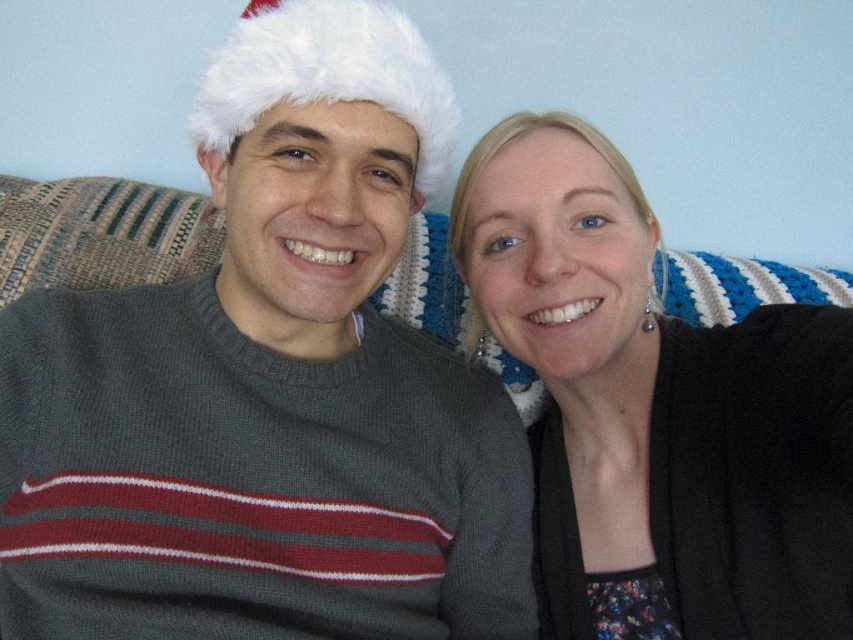
Can you confirm if black matte sweater at right is positioned to the right of white fluffy hat at upper center?

Indeed, black matte sweater at right is positioned on the right side of white fluffy hat at upper center.

Can you confirm if black matte sweater at right is thinner than white fluffy hat at upper center?

In fact, black matte sweater at right might be wider than white fluffy hat at upper center.

Is point (648, 525) positioned behind point (207, 65)?

Yes, point (648, 525) is behind point (207, 65).

This screenshot has height=640, width=853. Find the location of `black matte sweater at right`. black matte sweater at right is located at coordinates (656, 410).

Who is higher up, knit gray sweater at center or white fluffy hat at upper center?

Positioned higher is white fluffy hat at upper center.

From the picture: Is knit gray sweater at center above white fluffy hat at upper center?

No, knit gray sweater at center is not above white fluffy hat at upper center.

Between point (231, 104) and point (369, 77), which one is positioned behind?

Positioned behind is point (231, 104).

The width and height of the screenshot is (853, 640). Find the location of `knit gray sweater at center`. knit gray sweater at center is located at coordinates (270, 387).

Is knit gray sweater at center further to camera compared to black matte sweater at right?

Yes, it is behind black matte sweater at right.

Which of these two, knit gray sweater at center or black matte sweater at right, stands taller?

knit gray sweater at center is taller.

Is point (418, 208) in front of point (546, 433)?

Yes, point (418, 208) is closer to viewer.

This screenshot has height=640, width=853. What are the coordinates of `knit gray sweater at center` in the screenshot? It's located at (270, 387).